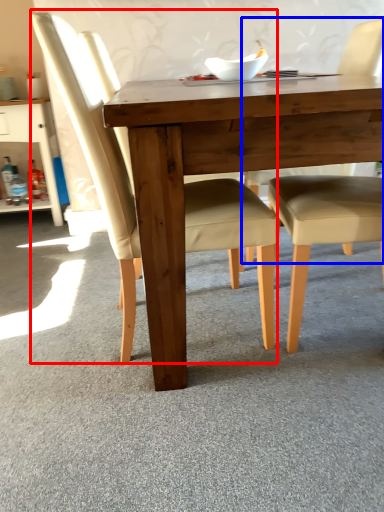
Question: Which of the following is the farthest to the observer, chair (highlighted by a red box) or chair (highlighted by a blue box)?

Choices:
 (A) chair
 (B) chair

Answer: (B)